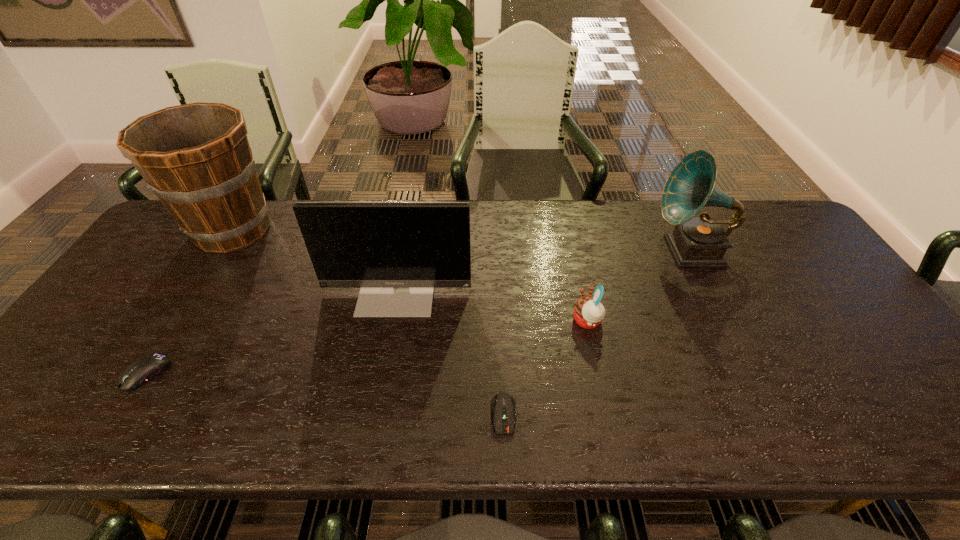
The height and width of the screenshot is (540, 960). Identify the location of free spot that satisfies the following two spatial constraints: 1. from the horn of the rightmost object; 2. on the screen of the computer monitor. (709, 290).